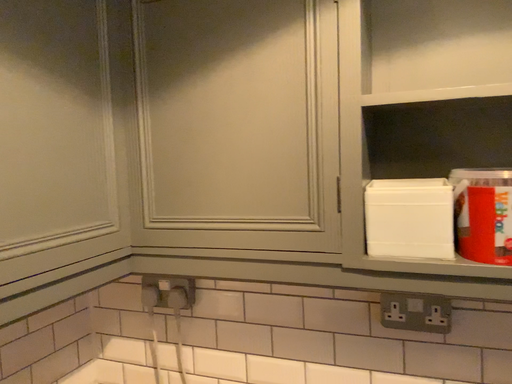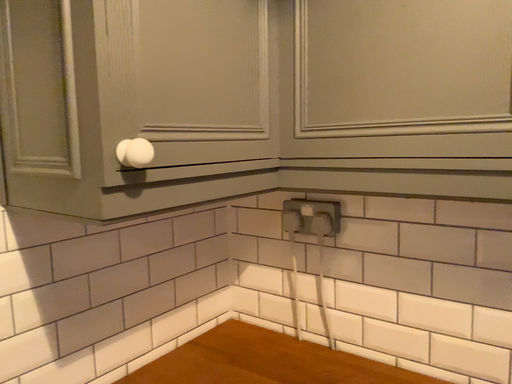
Question: Which way did the camera rotate in the video?

Choices:
 (A) rotated left
 (B) rotated right

Answer: (A)